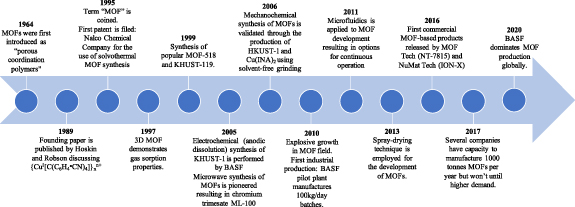
At what (x,y) coordinates should I click in order to perform the action: click on bracket. Please return your answer as a coordinate pair (x, y). The image size is (575, 207). Looking at the image, I should click on (44, 169), (88, 167).